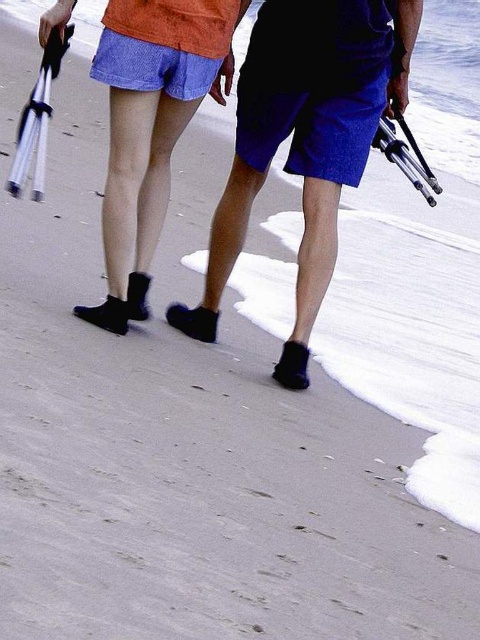
You are standing on the beach and see two points marked on the sand. The first point is at coordinates point (196, 56) and the second is at point (48, 35). If you want to walk towards the ocean, which point should you avoid stepping on to stay closer to the shore?

Point (196, 56) is behind point (48, 35), so to stay closer to the shore, you should avoid stepping on point (196, 56) and instead walk towards point (48, 35).

You are a photographer on the beach and notice two items at the center of your viewfinder. You see the black rubber sandals at center and the matte black socks at center. Which item is located to the right when looking from your perspective?

The black rubber sandals at center is positioned on the right side of matte black socks at center, so the black rubber sandals at center is to the right.

You are standing on the beach and see two points marked on the sand. The first point is labeled as point (302, 284) and the second as point (104, 240). Which point is closer to you if you are facing the ocean?

Point (104, 240) is closer to you because it is in front of point (302, 284) when facing the ocean.